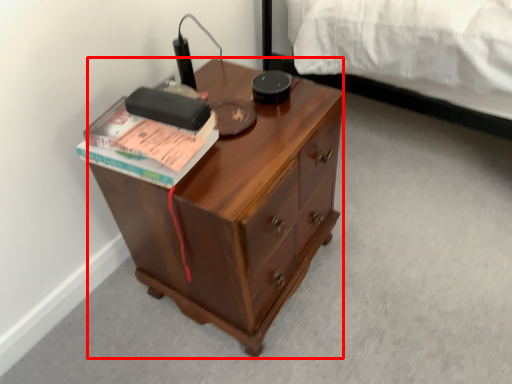
Question: From the image's perspective, where is desk (annotated by the red box) located relative to paperback book?

Choices:
 (A) below
 (B) above

Answer: (A)